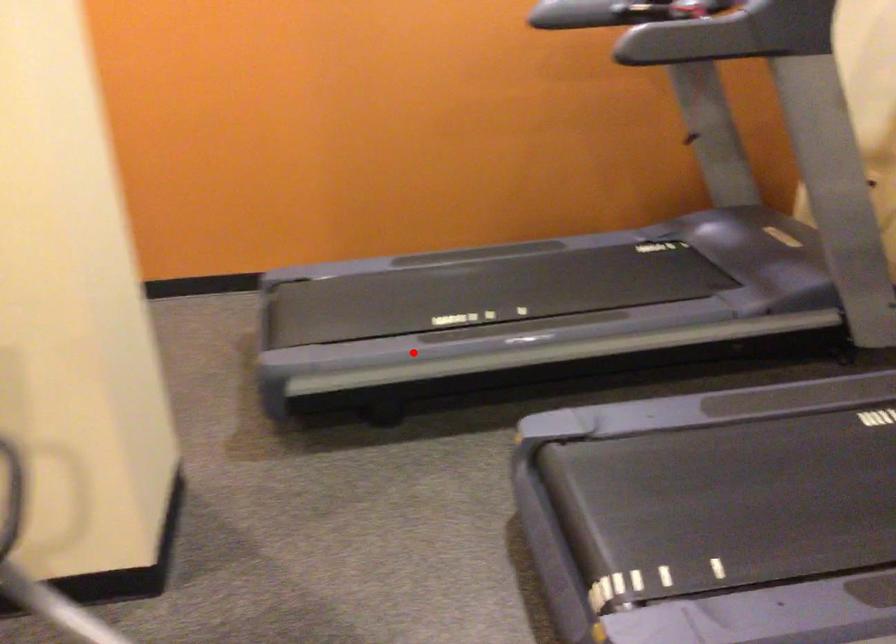
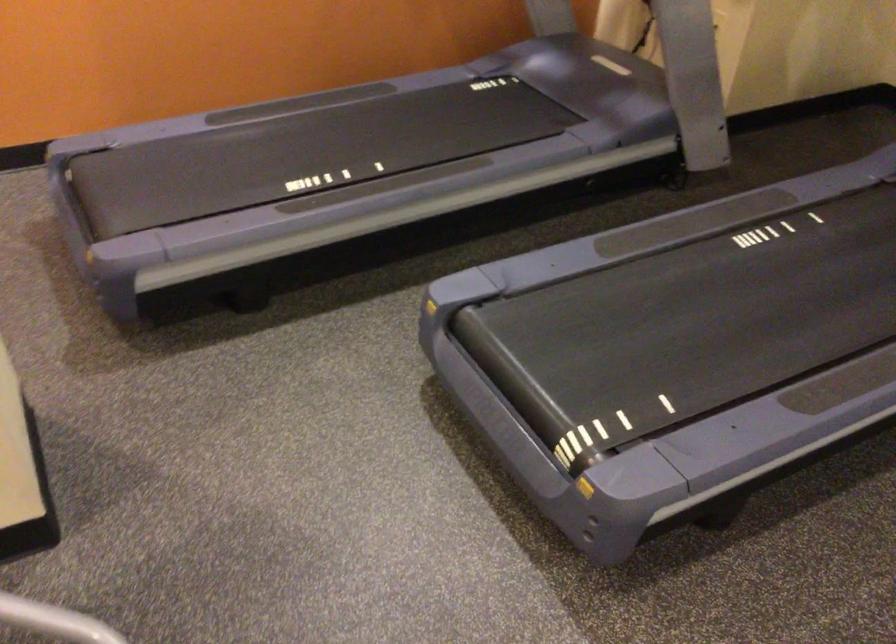
Find the pixel in the second image that matches the highlighted location in the first image.

(276, 225)